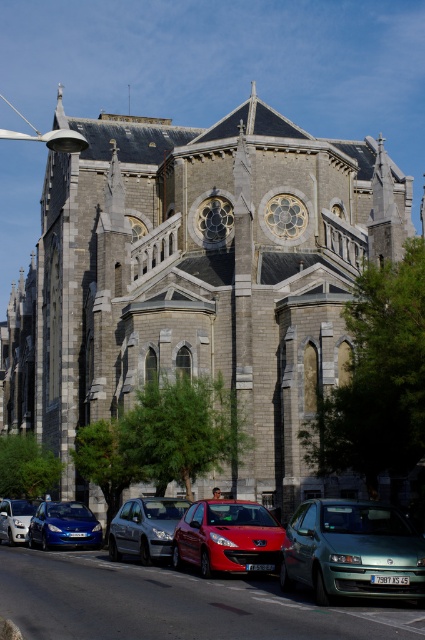
You are a delivery person who needs to park your van, which is 10 feet long, between the shiny red car at center and the silver metallic car at center. Can your van fit in the space between them?

The distance between the shiny red car at center and the silver metallic car at center is 11.26 feet. Since your van is 10 feet long, it can fit in the space between them as there is enough room.

You are a tour guide explaining the vehicles parked in front of the Gothic church. You mention both the shiny red car at center and the silver metallic car at center. Which car is wider?

The shiny red car at center is wider than the silver metallic car at center.